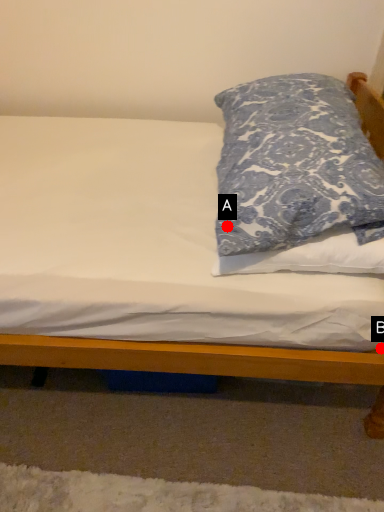
Question: Two points are circled on the image, labeled by A and B beside each circle. Which point is closer to the camera?

Choices:
 (A) A is closer
 (B) B is closer

Answer: (A)